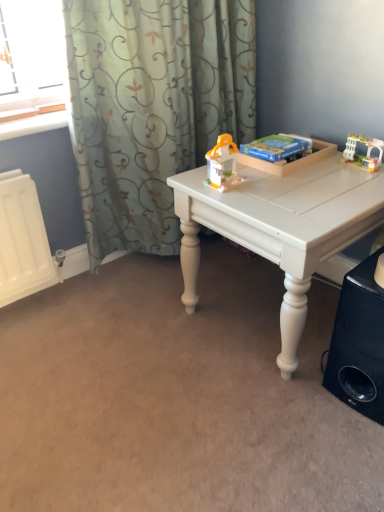
Question: Considering the relative sizes of translucent plastic toy at center, which ranks as the first toy in left-to-right order, and black matte speaker at lower right in the image provided, is translucent plastic toy at center, which ranks as the first toy in left-to-right order, shorter than black matte speaker at lower right?

Choices:
 (A) yes
 (B) no

Answer: (A)

Question: From the image's perspective, is translucent plastic toy at center, which ranks as the second toy in right-to-left order, located beneath black matte speaker at lower right?

Choices:
 (A) no
 (B) yes

Answer: (A)

Question: From a real-world perspective, is translucent plastic toy at center, which ranks as the first toy in left-to-right order, positioned over black matte speaker at lower right based on gravity?

Choices:
 (A) yes
 (B) no

Answer: (A)

Question: Is translucent plastic toy at center, which ranks as the second toy in right-to-left order, not close to black matte speaker at lower right?

Choices:
 (A) no
 (B) yes

Answer: (A)

Question: Does translucent plastic toy at center, which ranks as the second toy in right-to-left order, turn towards black matte speaker at lower right?

Choices:
 (A) no
 (B) yes

Answer: (A)

Question: Is white plastic toy at upper right, marked as the 2th toy in a left-to-right arrangement, wider or thinner than translucent plastic toy at center, which ranks as the first toy in left-to-right order?

Choices:
 (A) wide
 (B) thin

Answer: (B)

Question: From a real-world perspective, is white plastic toy at upper right, the first toy when ordered from right to left, above or below translucent plastic toy at center, which ranks as the first toy in left-to-right order?

Choices:
 (A) below
 (B) above

Answer: (A)

Question: Considering the positions of point click(x=354, y=155) and point click(x=238, y=175), is point click(x=354, y=155) closer or farther from the camera than point click(x=238, y=175)?

Choices:
 (A) closer
 (B) farther

Answer: (B)

Question: Would you say white plastic toy at upper right, the first toy when ordered from right to left, is to the left or to the right of translucent plastic toy at center, which ranks as the first toy in left-to-right order, in the picture?

Choices:
 (A) left
 (B) right

Answer: (B)

Question: In the image, is black matte speaker at lower right positioned in front of or behind satin green curtain at upper left?

Choices:
 (A) behind
 (B) front

Answer: (B)

Question: From a real-world perspective, is black matte speaker at lower right positioned above or below satin green curtain at upper left?

Choices:
 (A) above
 (B) below

Answer: (B)

Question: Visually, is black matte speaker at lower right positioned to the left or to the right of satin green curtain at upper left?

Choices:
 (A) right
 (B) left

Answer: (A)

Question: Is black matte speaker at lower right bigger or smaller than satin green curtain at upper left?

Choices:
 (A) small
 (B) big

Answer: (A)

Question: Visually, is satin green curtain at upper left positioned to the left or to the right of white matte table at center?

Choices:
 (A) left
 (B) right

Answer: (A)

Question: In terms of size, does satin green curtain at upper left appear bigger or smaller than white matte table at center?

Choices:
 (A) small
 (B) big

Answer: (B)